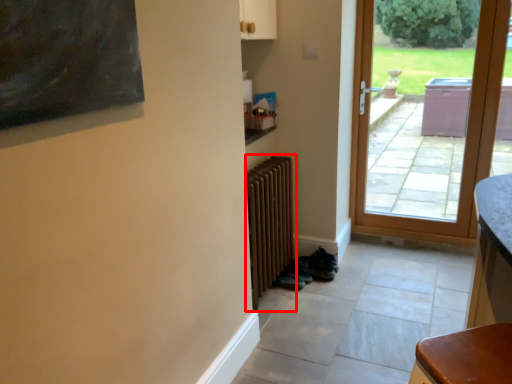
Question: From the image, what is the correct spatial relationship of radiator (annotated by the red box) in relation to door?

Choices:
 (A) left
 (B) right

Answer: (A)